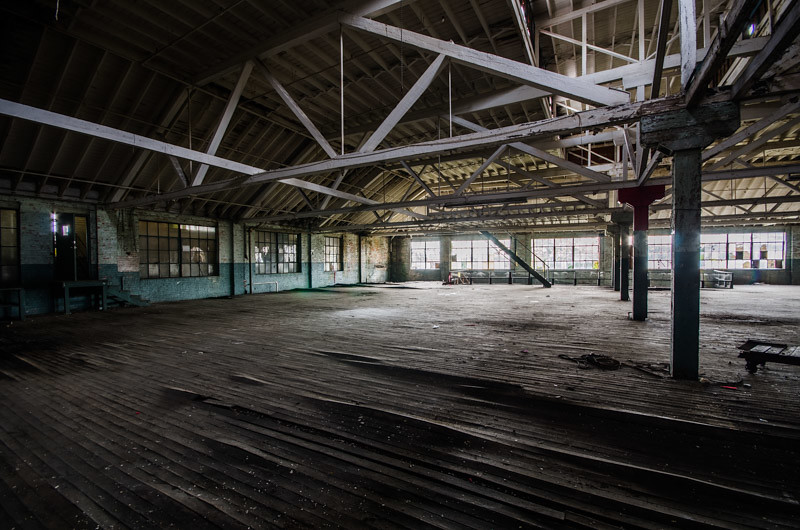
Find the location of a particular element. The width and height of the screenshot is (800, 530). floor is located at coordinates (442, 339), (754, 316).